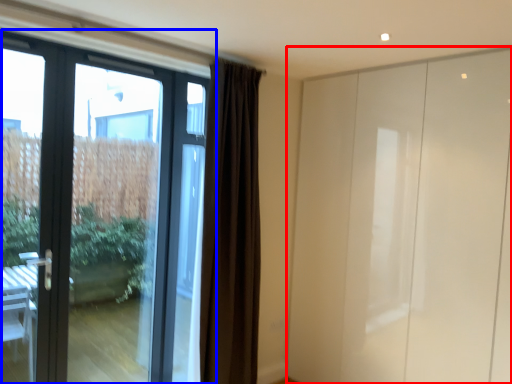
Question: Which object is further to the camera taking this photo, screen door (highlighted by a red box) or door (highlighted by a blue box)?

Choices:
 (A) screen door
 (B) door

Answer: (A)